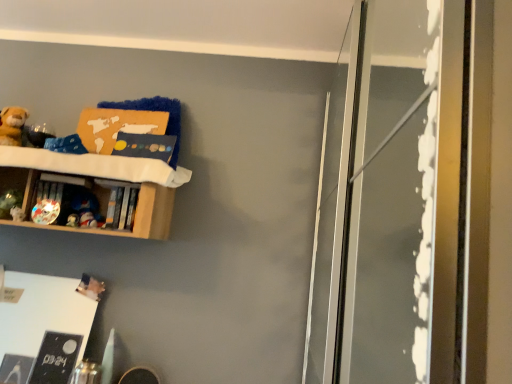
Find the location of `soft plush bear at upper left, the sixth toy when ordered from bottom to top`. soft plush bear at upper left, the sixth toy when ordered from bottom to top is located at coordinates (12, 125).

Describe the element at coordinates (85, 209) in the screenshot. I see `matte plastic toy at center-left, the 3th toy from the top` at that location.

What do you see at coordinates (73, 220) in the screenshot? I see `matte plastic toy at left, positioned as the fifth toy in top-to-bottom order` at bounding box center [73, 220].

This screenshot has width=512, height=384. I want to click on wooden shelf at upper left, so click(152, 213).

Image resolution: width=512 pixels, height=384 pixels. I want to click on matte plastic toy at upper left, acting as the sixth toy starting from the top, so click(x=87, y=220).

Which object is positioned more to the right, white matte board at lower left or matte plastic toy at left, marked as the second toy in a bottom-to-top arrangement?

From the viewer's perspective, matte plastic toy at left, marked as the second toy in a bottom-to-top arrangement, appears more on the right side.

Between white matte board at lower left and matte plastic toy at left, marked as the second toy in a bottom-to-top arrangement, which one has smaller width?

matte plastic toy at left, marked as the second toy in a bottom-to-top arrangement, is thinner.

In the scene shown: Measure the distance from white matte board at lower left to matte plastic toy at left, positioned as the fifth toy in top-to-bottom order.

white matte board at lower left is 19.92 inches from matte plastic toy at left, positioned as the fifth toy in top-to-bottom order.

How many degrees apart are the facing directions of white matte board at lower left and matte plastic toy at left, positioned as the fifth toy in top-to-bottom order?

4.02 degrees.

Is matte plastic toy at left, marked as the second toy in a bottom-to-top arrangement, positioned far away from wooden shelf at upper left?

That's not correct — matte plastic toy at left, marked as the second toy in a bottom-to-top arrangement, is a little close to wooden shelf at upper left.

Looking at this image, which object is positioned more to the left, matte plastic toy at left, marked as the second toy in a bottom-to-top arrangement, or wooden shelf at upper left?

wooden shelf at upper left.

From a real-world perspective, who is located lower, matte plastic toy at left, positioned as the fifth toy in top-to-bottom order, or wooden shelf at upper left?

matte plastic toy at left, positioned as the fifth toy in top-to-bottom order.

Is matte plastic toy at left, marked as the second toy in a bottom-to-top arrangement, aimed at wooden shelf at upper left?

Yes.

Who is more distant, matte plastic toy at center-left, the fourth toy ordered from the bottom, or shiny metallic toy at left, arranged as the 5th toy when ordered from the bottom?

matte plastic toy at center-left, the fourth toy ordered from the bottom.

From a real-world perspective, between matte plastic toy at center-left, the fourth toy ordered from the bottom, and shiny metallic toy at left, the 2th toy when ordered from top to bottom, who is vertically lower?

From a 3D spatial view, shiny metallic toy at left, the 2th toy when ordered from top to bottom, is below.

From the image's perspective, is matte plastic toy at center-left, the 3th toy from the top, below shiny metallic toy at left, the 2th toy when ordered from top to bottom?

Indeed, from the image's perspective, matte plastic toy at center-left, the 3th toy from the top, is shown beneath shiny metallic toy at left, the 2th toy when ordered from top to bottom.

Locate an element on the screen. toy that is the 2nd object to the right of the shiny metallic toy at left, arranged as the 5th toy when ordered from the bottom, starting at the anchor is located at coordinates (85, 209).

Which object is positioned more to the right, wooden shelf at upper left or matte plastic toy at center-left, the fourth toy ordered from the bottom?

matte plastic toy at center-left, the fourth toy ordered from the bottom, is more to the right.

Are wooden shelf at upper left and matte plastic toy at center-left, the 3th toy from the top, far apart?

Actually, wooden shelf at upper left and matte plastic toy at center-left, the 3th toy from the top, are a little close together.

From a real-world perspective, is wooden shelf at upper left under matte plastic toy at center-left, the 3th toy from the top?

Incorrect, from a real-world perspective, wooden shelf at upper left is higher than matte plastic toy at center-left, the 3th toy from the top.

Find the location of a particular element. This screenshot has height=384, width=512. shelf above the matte plastic toy at center-left, the 3th toy from the top (from a real-world perspective) is located at coordinates (152, 213).

Considering the sizes of objects matte plastic toy at center-left, the 3th toy from the top, and white matte board at lower left in the image provided, who is thinner, matte plastic toy at center-left, the 3th toy from the top, or white matte board at lower left?

matte plastic toy at center-left, the 3th toy from the top.

Are matte plastic toy at center-left, the fourth toy ordered from the bottom, and white matte board at lower left located far from each other?

That's not correct — matte plastic toy at center-left, the fourth toy ordered from the bottom, is a little close to white matte board at lower left.

From the image's perspective, is matte plastic toy at center-left, the 3th toy from the top, located beneath white matte board at lower left?

Actually, matte plastic toy at center-left, the 3th toy from the top, appears above white matte board at lower left in the image.

In the scene shown: Is matte plastic toy at center-left, the 3th toy from the top, taller than white matte board at lower left?

No, matte plastic toy at center-left, the 3th toy from the top, is not taller than white matte board at lower left.

Could you tell me if shiny metallic toy at left, the 2th toy when ordered from top to bottom, is facing wooden shelf at upper left?

Yes, shiny metallic toy at left, the 2th toy when ordered from top to bottom, faces towards wooden shelf at upper left.

How distant is shiny metallic toy at left, arranged as the 5th toy when ordered from the bottom, from wooden shelf at upper left?

The distance of shiny metallic toy at left, arranged as the 5th toy when ordered from the bottom, from wooden shelf at upper left is 10.61 inches.

Based on the photo, does shiny metallic toy at left, the 2th toy when ordered from top to bottom, have a lesser height compared to wooden shelf at upper left?

Yes.

Which object is positioned more to the right, shiny metallic toy at left, the 2th toy when ordered from top to bottom, or wooden shelf at upper left?

wooden shelf at upper left.

Is transparent glass screen door at right positioned with its back to soft plush bear at upper left, which ranks as the 1th toy in top-to-bottom order?

transparent glass screen door at right is not turned away from soft plush bear at upper left, which ranks as the 1th toy in top-to-bottom order.

How many degrees apart are the facing directions of transparent glass screen door at right and soft plush bear at upper left, the sixth toy when ordered from bottom to top?

91.4 degrees.

Is transparent glass screen door at right with soft plush bear at upper left, the sixth toy when ordered from bottom to top?

No, transparent glass screen door at right is not with soft plush bear at upper left, the sixth toy when ordered from bottom to top.

Between transparent glass screen door at right and soft plush bear at upper left, which ranks as the 1th toy in top-to-bottom order, which one has larger size?

Bigger between the two is transparent glass screen door at right.

The height and width of the screenshot is (384, 512). I want to click on table that is in front of the matte plastic toy at left, positioned as the fifth toy in top-to-bottom order, so click(x=42, y=328).

Image resolution: width=512 pixels, height=384 pixels. I want to click on shelf above the matte plastic toy at left, marked as the second toy in a bottom-to-top arrangement (from a real-world perspective), so click(x=152, y=213).

Considering their positions, is shiny metallic toy at left, arranged as the 5th toy when ordered from the bottom, positioned further to matte plastic toy at upper left, acting as the sixth toy starting from the top, than transparent glass screen door at right?

transparent glass screen door at right lies further to matte plastic toy at upper left, acting as the sixth toy starting from the top, than the other object.

Looking at the image, which one is located further to matte plastic toy at upper left, marked as the first toy in a bottom-to-top arrangement, shiny metallic toy at left, arranged as the 5th toy when ordered from the bottom, or matte plastic toy at left, marked as the second toy in a bottom-to-top arrangement?

Based on the image, shiny metallic toy at left, arranged as the 5th toy when ordered from the bottom, appears to be further to matte plastic toy at upper left, marked as the first toy in a bottom-to-top arrangement.

From the picture: Which object lies further to the anchor point matte plastic toy at upper left, marked as the first toy in a bottom-to-top arrangement, matte plastic toy at left, arranged as the third toy when ordered from the bottom, or soft plush bear at upper left, which ranks as the 1th toy in top-to-bottom order?

Among the two, soft plush bear at upper left, which ranks as the 1th toy in top-to-bottom order, is located further to matte plastic toy at upper left, marked as the first toy in a bottom-to-top arrangement.

Looking at the image, which one is located closer to matte plastic toy at center-left, the 3th toy from the top, matte plastic toy at left, arranged as the third toy when ordered from the bottom, or matte plastic toy at left, marked as the second toy in a bottom-to-top arrangement?

matte plastic toy at left, marked as the second toy in a bottom-to-top arrangement.

From the image, which object appears to be farther from soft plush bear at upper left, which ranks as the 1th toy in top-to-bottom order, matte plastic toy at center-left, the 3th toy from the top, or shiny metallic toy at left, the 2th toy when ordered from top to bottom?

matte plastic toy at center-left, the 3th toy from the top, is further to soft plush bear at upper left, which ranks as the 1th toy in top-to-bottom order.

Which object lies nearer to the anchor point wooden shelf at upper left, soft plush bear at upper left, which ranks as the 1th toy in top-to-bottom order, or matte plastic toy at center-left, the 3th toy from the top?

matte plastic toy at center-left, the 3th toy from the top, lies closer to wooden shelf at upper left than the other object.

Estimate the real-world distances between objects in this image. Which object is closer to white matte board at lower left, matte plastic toy at upper left, acting as the sixth toy starting from the top, or wooden shelf at upper left?

wooden shelf at upper left lies closer to white matte board at lower left than the other object.

When comparing their distances from transparent glass screen door at right, does matte plastic toy at center-left, the fourth toy ordered from the bottom, or white matte board at lower left seem closer?

matte plastic toy at center-left, the fourth toy ordered from the bottom, is positioned closer to the anchor transparent glass screen door at right.

Find the location of a particular element. This screenshot has height=384, width=512. table between transparent glass screen door at right and matte plastic toy at center-left, the 3th toy from the top, along the z-axis is located at coordinates (42, 328).

Identify the location of shelf that lies between soft plush bear at upper left, which ranks as the 1th toy in top-to-bottom order, and shiny metallic toy at left, the 2th toy when ordered from top to bottom, from top to bottom. The height and width of the screenshot is (384, 512). (152, 213).

Find the location of a particular element. Image resolution: width=512 pixels, height=384 pixels. toy between matte plastic toy at left, the fourth toy in the top-to-bottom sequence, and matte plastic toy at left, positioned as the fifth toy in top-to-bottom order, from left to right is located at coordinates (45, 211).

Find the location of a particular element. table between matte plastic toy at left, the fourth toy in the top-to-bottom sequence, and transparent glass screen door at right, in the horizontal direction is located at coordinates (42, 328).